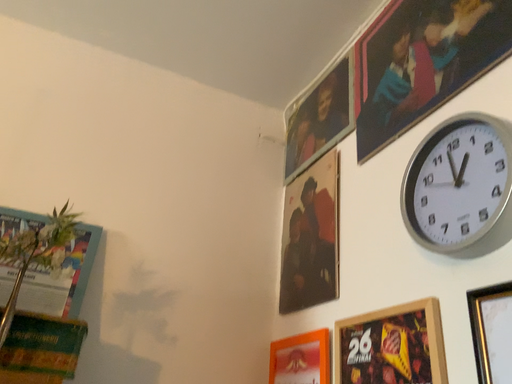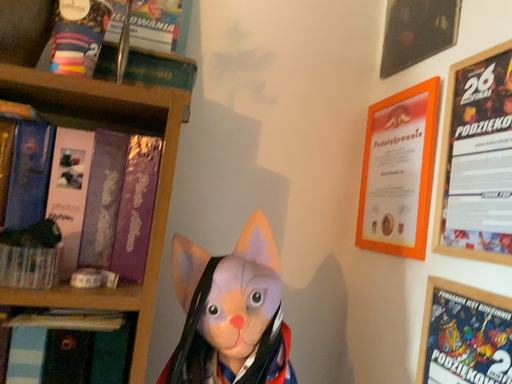
Question: How did the camera likely rotate when shooting the video?

Choices:
 (A) rotated right
 (B) rotated left

Answer: (B)